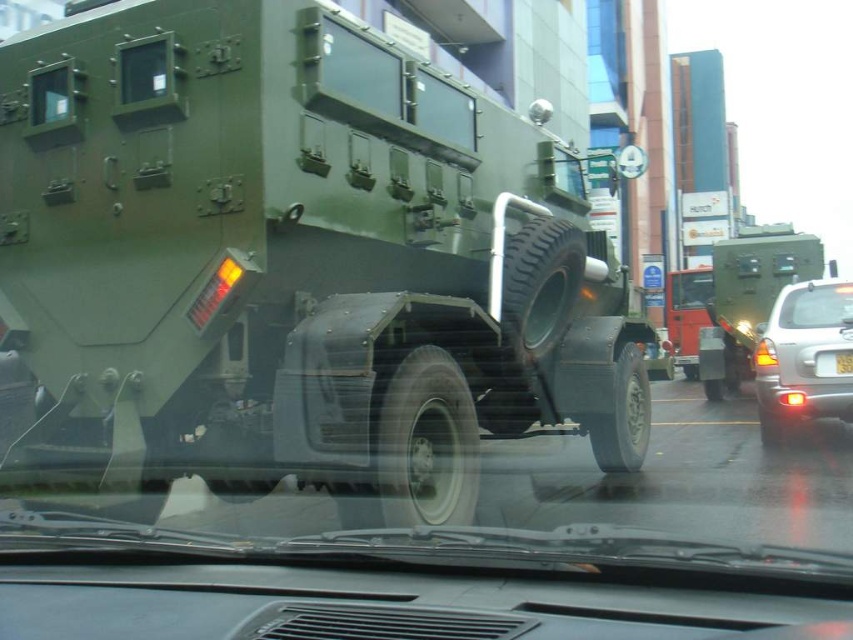
Question: Is matte green tank at center bigger than white plastic license plate at center?

Choices:
 (A) yes
 (B) no

Answer: (A)

Question: Is matte green tank at center to the right of silver metallic car at right from the viewer's perspective?

Choices:
 (A) no
 (B) yes

Answer: (A)

Question: Which of the following is the farthest from the observer?

Choices:
 (A) transparent glass windshield at center
 (B) white plastic license plate at center
 (C) matte green tank at center
 (D) silver metallic car at right

Answer: (A)

Question: Is matte green tank at center above silver metallic car at right?

Choices:
 (A) yes
 (B) no

Answer: (A)

Question: Which point is closer to the camera?

Choices:
 (A) transparent glass windshield at center
 (B) silver metallic car at right

Answer: (B)

Question: Which point is farther to the camera?

Choices:
 (A) silver metallic car at right
 (B) white plastic license plate at center
 (C) matte green tank at center
 (D) transparent glass windshield at center

Answer: (D)